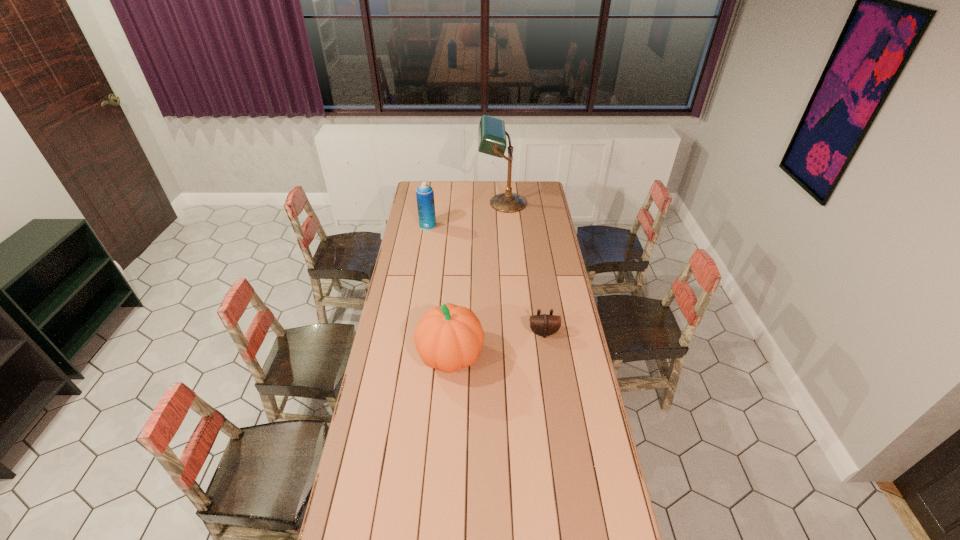
Locate an element on the screen. Image resolution: width=960 pixels, height=540 pixels. table lamp is located at coordinates (491, 132).

You are a GUI agent. You are given a task and a screenshot of the screen. Output one action in this format:
    pyautogui.click(x=<x>, y=<y>)
    Task: Click on the pumpkin
    The image size is (960, 540).
    Given the screenshot: What is the action you would take?
    pyautogui.click(x=450, y=337)

In order to click on aerosol can in this screenshot , I will do `click(424, 193)`.

The height and width of the screenshot is (540, 960). What are the coordinates of `the shortest object` in the screenshot? It's located at (544, 325).

You are a GUI agent. You are given a task and a screenshot of the screen. Output one action in this format:
    pyautogui.click(x=<x>, y=<y>)
    Task: Click on the vacant space located 0.100m above the green lampshade of the tallest object
    This screenshot has width=960, height=540.
    Given the screenshot: What is the action you would take?
    pyautogui.click(x=463, y=203)

Locate an element on the screen. vacant position located 0.220m above the green lampshade of the tallest object is located at coordinates (444, 203).

I want to click on vacant point located above the green lampshade of the tallest object, so click(430, 203).

The width and height of the screenshot is (960, 540). In order to click on vacant area situated 0.130m on the front of the pumpkin in this screenshot , I will do `click(446, 414)`.

This screenshot has width=960, height=540. Find the location of `vacant region located on the back of the aerosol can`. vacant region located on the back of the aerosol can is located at coordinates (432, 197).

This screenshot has width=960, height=540. Identify the location of free space located with the flap open on the pouch. (552, 394).